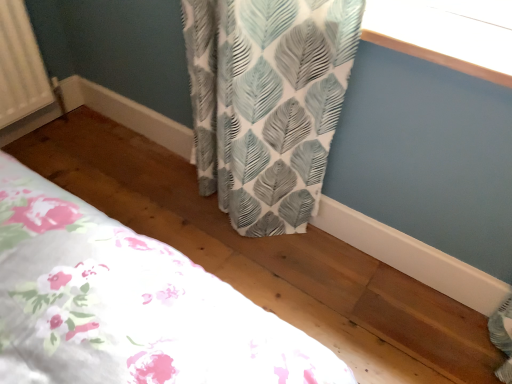
Question: Does white leaf-patterned curtain at upper right have a larger size compared to floral fabric bed at lower left?

Choices:
 (A) yes
 (B) no

Answer: (B)

Question: From the image's perspective, is white leaf-patterned curtain at upper right located beneath floral fabric bed at lower left?

Choices:
 (A) yes
 (B) no

Answer: (B)

Question: Is white leaf-patterned curtain at upper right taller than floral fabric bed at lower left?

Choices:
 (A) yes
 (B) no

Answer: (B)

Question: Is white leaf-patterned curtain at upper right at the right side of floral fabric bed at lower left?

Choices:
 (A) yes
 (B) no

Answer: (A)

Question: Is the depth of white leaf-patterned curtain at upper right less than that of floral fabric bed at lower left?

Choices:
 (A) no
 (B) yes

Answer: (B)

Question: From a real-world perspective, is white leaf-patterned curtain at upper right positioned under floral fabric bed at lower left based on gravity?

Choices:
 (A) no
 (B) yes

Answer: (A)

Question: Is floral fabric bed at lower left oriented towards white leaf-patterned curtain at upper right?

Choices:
 (A) yes
 (B) no

Answer: (B)

Question: Is floral fabric bed at lower left thinner than white leaf-patterned curtain at upper right?

Choices:
 (A) no
 (B) yes

Answer: (A)

Question: Is floral fabric bed at lower left in contact with white leaf-patterned curtain at upper right?

Choices:
 (A) no
 (B) yes

Answer: (A)

Question: From the image's perspective, is floral fabric bed at lower left below white leaf-patterned curtain at upper right?

Choices:
 (A) yes
 (B) no

Answer: (A)

Question: Would you say white leaf-patterned curtain at upper right is part of floral fabric bed at lower left's contents?

Choices:
 (A) no
 (B) yes

Answer: (A)

Question: Is floral fabric bed at lower left not within white leaf-patterned curtain at upper right?

Choices:
 (A) yes
 (B) no

Answer: (A)

Question: Is floral fabric bed at lower left in front of or behind white leaf-patterned curtain at upper right in the image?

Choices:
 (A) front
 (B) behind

Answer: (B)